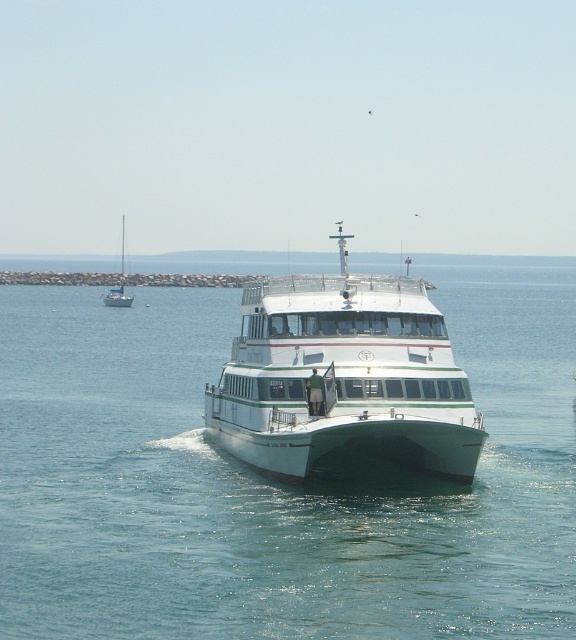
Which is below, green water at center or white glossy sailboat at left?

green water at center

Is green water at center shorter than white glossy sailboat at left?

No, green water at center is not shorter than white glossy sailboat at left.

Locate an element on the screen. Image resolution: width=576 pixels, height=640 pixels. green water at center is located at coordinates (274, 481).

Can you confirm if white glossy cruise ship at center is positioned to the right of white glossy sailboat at left?

Correct, you'll find white glossy cruise ship at center to the right of white glossy sailboat at left.

Based on the photo, can you confirm if white glossy cruise ship at center is taller than white glossy sailboat at left?

No, white glossy cruise ship at center is not taller than white glossy sailboat at left.

Measure the distance between point (306, 346) and camera.

The distance of point (306, 346) from camera is 35.39 meters.

The image size is (576, 640). I want to click on white glossy cruise ship at center, so click(x=343, y=378).

Which of these two, green water at center or white glossy cruise ship at center, stands shorter?

Standing shorter between the two is white glossy cruise ship at center.

Which is in front, point (232, 467) or point (432, 460)?

Point (432, 460) is in front.

Locate an element on the screen. The height and width of the screenshot is (640, 576). green water at center is located at coordinates (274, 481).